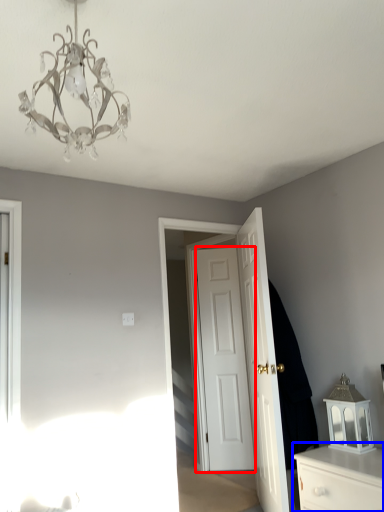
Question: Among these objects, which one is farthest to the camera, door (highlighted by a red box) or chest of drawers (highlighted by a blue box)?

Choices:
 (A) door
 (B) chest of drawers

Answer: (A)